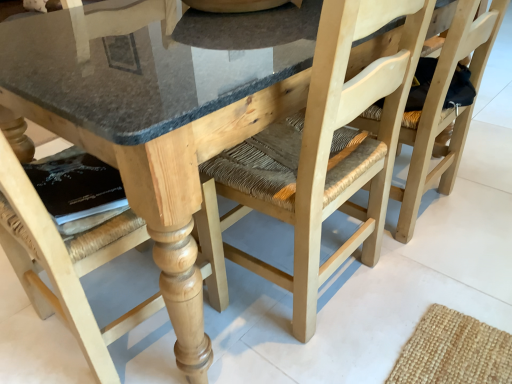
What are the coordinates of `free space on the front side of natural wood chair at center, acting as the 2th chair starting from the right` in the screenshot? It's located at [x=326, y=353].